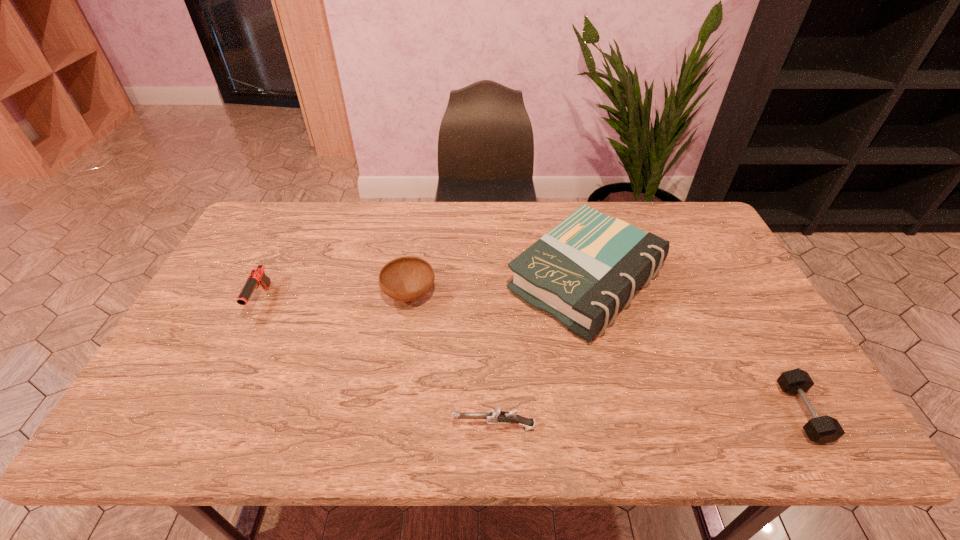
Where is `object that is at the near right corner`? The height and width of the screenshot is (540, 960). object that is at the near right corner is located at coordinates (825, 429).

Find the location of a particular element. This screenshot has height=540, width=960. free location at the far edge of the desktop is located at coordinates (626, 207).

I want to click on free space at the near edge of the desktop, so [355, 428].

The height and width of the screenshot is (540, 960). In the image, there is a desktop. What are the coordinates of `free space at the left edge` in the screenshot? It's located at (155, 404).

At what (x,y) coordinates should I click in order to perform the action: click on vacant space at the far right corner of the desktop. Please return your answer as a coordinate pair (x, y). The height and width of the screenshot is (540, 960). Looking at the image, I should click on (668, 205).

The width and height of the screenshot is (960, 540). I want to click on empty space that is in between the dumbbell and the paperback book, so click(x=694, y=347).

Find the location of a particular element. The width and height of the screenshot is (960, 540). free point between the tallest object and the second object from left to right is located at coordinates (498, 288).

Identify the location of vacant area that lies between the second object from left to right and the tallest object. This screenshot has width=960, height=540. (498, 288).

This screenshot has height=540, width=960. I want to click on vacant area that lies between the shortest object and the leftmost object, so click(x=531, y=356).

Identify the location of vacant point located between the shorter gun and the second object from left to right. (452, 361).